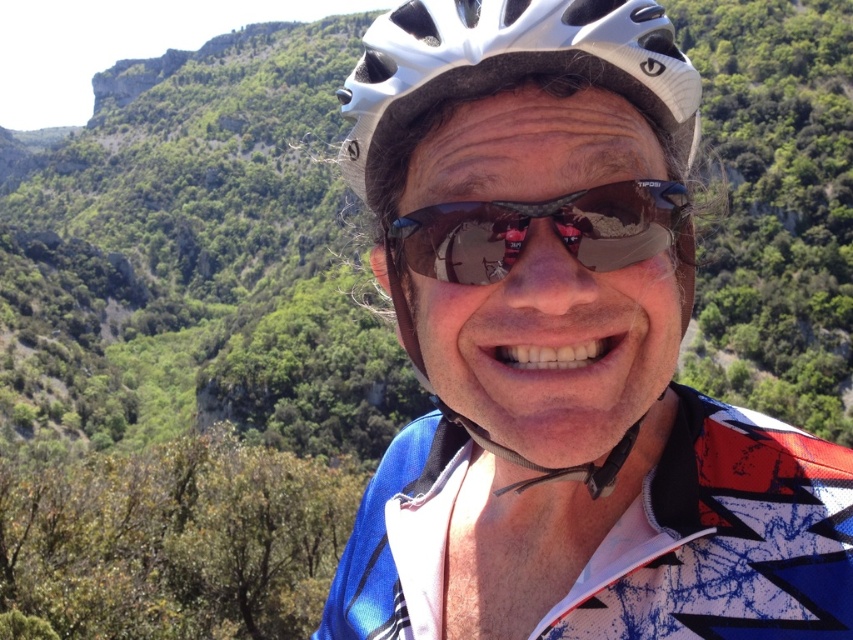
You are a photographer trying to capture the reflection of the mountainous background in the shiny reflective sunglasses at center and the white matte helmet at center. Which object will show a clearer reflection of the background?

The shiny reflective sunglasses at center will show a clearer reflection of the mountainous background because they are reflective, whereas the white matte helmet at center has a matte surface which does not reflect as well.

You are a photographer trying to capture the cyclist in the scene. Since both the white matte bicycle helmet at center and the shiny reflective sunglasses at center are at the center, which object will appear larger in your photo?

The white matte bicycle helmet at center will appear larger in the photo because it is bigger than the shiny reflective sunglasses at center.

You are a photographer trying to capture the person in the scene. You want to ensure both the white matte bicycle helmet at center and the shiny reflective sunglasses at center are clearly visible in your shot. Given that your camera has a depth of field that can sharply focus on objects within a 4 meter range, will both items remain in focus?

→ The distance between the white matte bicycle helmet at center and shiny reflective sunglasses at center is 4.14 meters. Since the depth of field can only sharply focus within 4 meters, the two items are slightly beyond the camera s range, so they might not both be in focus simultaneously.